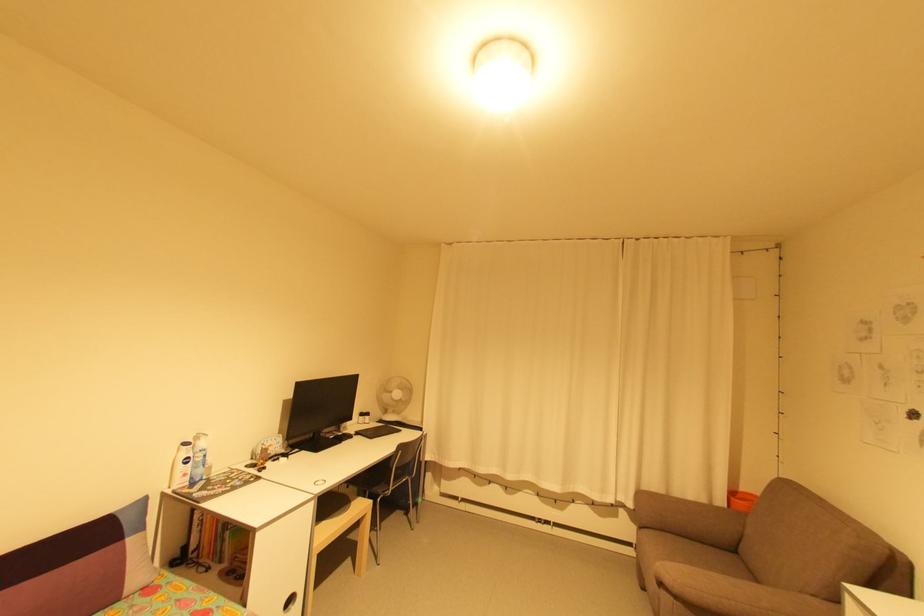
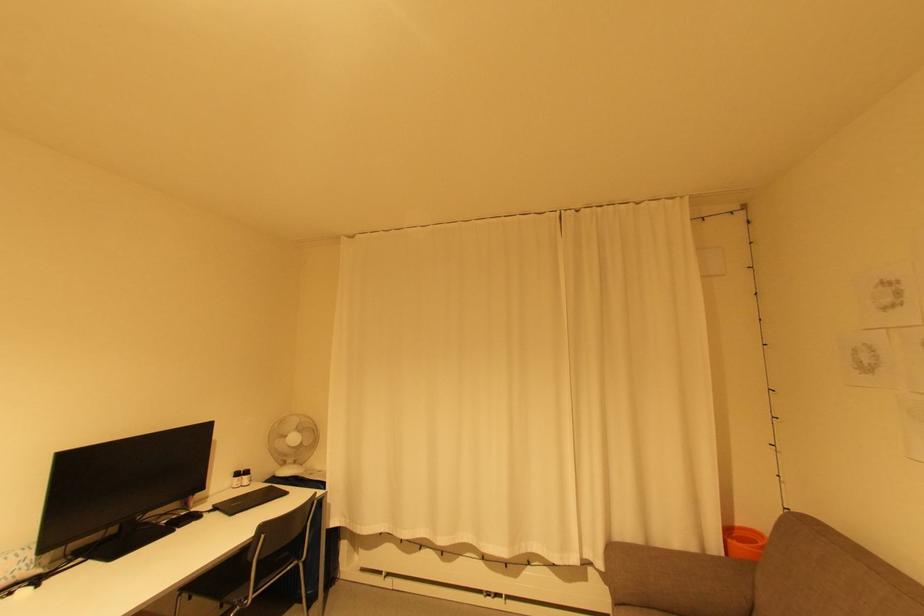
In the second image, find the point that corresponds to point (746, 539) in the first image.

(757, 609)